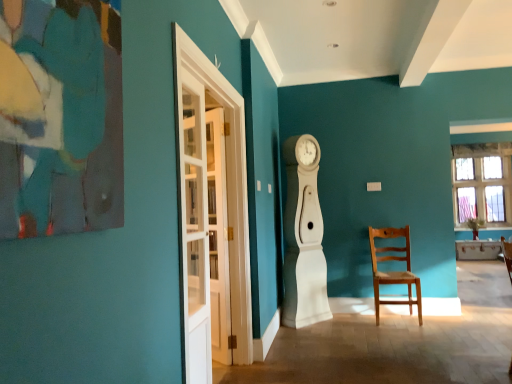
The image size is (512, 384). What do you see at coordinates (211, 212) in the screenshot? I see `white glass door at left, positioned as the 1th glass door in front-to-back order` at bounding box center [211, 212].

Identify the location of white glass door at left, positioned as the 1th glass door in front-to-back order. The width and height of the screenshot is (512, 384). (211, 212).

Locate an element on the screen. This screenshot has height=384, width=512. light brown wooden chair at center right is located at coordinates (393, 271).

Measure the distance between light brown wooden chair at center right and camera.

They are 4.06 meters apart.

Find the location of `white glass door at left, the first glass door in the back-to-front sequence`. white glass door at left, the first glass door in the back-to-front sequence is located at coordinates (194, 229).

Find the location of a particular element. white wooden door at left is located at coordinates (218, 238).

From the image's perspective, between white glass door at left, marked as the 2th glass door in a front-to-back arrangement, and white glass door at left, the 2th glass door from the back, which one is located above?

white glass door at left, marked as the 2th glass door in a front-to-back arrangement, is shown above in the image.

Are white glass door at left, marked as the 2th glass door in a front-to-back arrangement, and white glass door at left, positioned as the 1th glass door in front-to-back order, far apart?

white glass door at left, marked as the 2th glass door in a front-to-back arrangement, is near white glass door at left, positioned as the 1th glass door in front-to-back order, not far away.

Measure the distance from white glass door at left, marked as the 2th glass door in a front-to-back arrangement, to white glass door at left, the 2th glass door from the back.

3.63 inches.

How different are the orientations of white glass door at left, the first glass door in the back-to-front sequence, and white glass door at left, the 2th glass door from the back, in degrees?

0.000584 degrees.

Is clear glass window at upper right located outside light brown wooden chair at center right?

clear glass window at upper right lies outside light brown wooden chair at center right's area.

Who is taller, clear glass window at upper right or light brown wooden chair at center right?

clear glass window at upper right is taller.

Considering the sizes of objects clear glass window at upper right and light brown wooden chair at center right in the image provided, who is smaller, clear glass window at upper right or light brown wooden chair at center right?

Smaller between the two is light brown wooden chair at center right.

From the picture: From a real-world perspective, between white wooden door at left and light brown wooden chair at center right, who is vertically lower?

light brown wooden chair at center right, from a real-world perspective.

From the image's perspective, is white wooden door at left located above or below light brown wooden chair at center right?

white wooden door at left is above light brown wooden chair at center right.

Is white wooden door at left facing towards light brown wooden chair at center right?

No, white wooden door at left is not facing towards light brown wooden chair at center right.

Who is bigger, white wooden door at left or light brown wooden chair at center right?

light brown wooden chair at center right.

Does white wooden door at left appear on the right side of white glass door at left, the first glass door in the back-to-front sequence?

Yes.

From the image's perspective, would you say white wooden door at left is shown under white glass door at left, marked as the 2th glass door in a front-to-back arrangement?

Correct, white wooden door at left appears lower than white glass door at left, marked as the 2th glass door in a front-to-back arrangement, in the image.

In the scene shown: Between white wooden door at left and white glass door at left, the first glass door in the back-to-front sequence, which one has larger width?

With larger width is white glass door at left, the first glass door in the back-to-front sequence.

From the picture: Are light brown wooden chair at center right and clear glass window at upper right making contact?

No, light brown wooden chair at center right is not beside clear glass window at upper right.

The height and width of the screenshot is (384, 512). Identify the location of chair below the clear glass window at upper right (from the image's perspective). (393, 271).

From the image's perspective, which one is positioned lower, light brown wooden chair at center right or clear glass window at upper right?

light brown wooden chair at center right, from the image's perspective.

Image resolution: width=512 pixels, height=384 pixels. In order to click on chair beneath the white glass door at left, marked as the 2th glass door in a front-to-back arrangement (from a real-world perspective) in this screenshot , I will do `click(393, 271)`.

From a real-world perspective, between light brown wooden chair at center right and white glass door at left, the first glass door in the back-to-front sequence, who is vertically lower?

light brown wooden chair at center right, from a real-world perspective.

Between light brown wooden chair at center right and white glass door at left, marked as the 2th glass door in a front-to-back arrangement, which one has smaller size?

white glass door at left, marked as the 2th glass door in a front-to-back arrangement, is smaller.

Would you say light brown wooden chair at center right contains white glass door at left, marked as the 2th glass door in a front-to-back arrangement?

No, white glass door at left, marked as the 2th glass door in a front-to-back arrangement, is not a part of light brown wooden chair at center right.

From the image's perspective, which is above, light brown wooden chair at center right or white glass door at left, the 2th glass door from the back?

white glass door at left, the 2th glass door from the back, is shown above in the image.

Based on the photo, is light brown wooden chair at center right positioned far away from white glass door at left, the 2th glass door from the back?

Yes, light brown wooden chair at center right and white glass door at left, the 2th glass door from the back, are quite far apart.

Does point (401, 304) come farther from viewer compared to point (190, 325)?

Yes, point (401, 304) is behind point (190, 325).

Identify the location of chair behind the white glass door at left, the 2th glass door from the back. (393, 271).

You are a GUI agent. You are given a task and a screenshot of the screen. Output one action in this format:
    pyautogui.click(x=<x>, y=<y>)
    Task: Click on the glass door lying in front of the white glass door at left, marked as the 2th glass door in a front-to-back arrangement
    
    Given the screenshot: What is the action you would take?
    pyautogui.click(x=211, y=212)

Locate an element on the screen. This screenshot has width=512, height=384. window lying on the right of light brown wooden chair at center right is located at coordinates (482, 183).

When comparing their distances from white wooden door at left, does light brown wooden chair at center right or white glass door at left, marked as the 2th glass door in a front-to-back arrangement, seem closer?

Among the two, white glass door at left, marked as the 2th glass door in a front-to-back arrangement, is located nearer to white wooden door at left.

Looking at the image, which one is located closer to white glass door at left, marked as the 2th glass door in a front-to-back arrangement, white wooden door at left or light brown wooden chair at center right?

white wooden door at left is closer to white glass door at left, marked as the 2th glass door in a front-to-back arrangement.

Which object lies further to the anchor point white wooden door at left, white glass door at left, marked as the 2th glass door in a front-to-back arrangement, or light brown wooden chair at center right?

The object further to white wooden door at left is light brown wooden chair at center right.

Based on the photo, when comparing their distances from white glass door at left, the first glass door in the back-to-front sequence, does clear glass window at upper right or white wooden door at left seem further?

Based on the image, clear glass window at upper right appears to be further to white glass door at left, the first glass door in the back-to-front sequence.

Looking at the image, which one is located closer to white wooden door at left, white glass door at left, marked as the 2th glass door in a front-to-back arrangement, or clear glass window at upper right?

white glass door at left, marked as the 2th glass door in a front-to-back arrangement, is closer to white wooden door at left.

Looking at this image, which object lies nearer to the anchor point light brown wooden chair at center right, white wooden door at left or white glass door at left, the first glass door in the back-to-front sequence?

Based on the image, white wooden door at left appears to be nearer to light brown wooden chair at center right.

When comparing their distances from clear glass window at upper right, does white glass door at left, the first glass door in the back-to-front sequence, or light brown wooden chair at center right seem closer?

Based on the image, light brown wooden chair at center right appears to be nearer to clear glass window at upper right.

When comparing their distances from light brown wooden chair at center right, does white glass door at left, the 2th glass door from the back, or white glass door at left, marked as the 2th glass door in a front-to-back arrangement, seem further?

The object further to light brown wooden chair at center right is white glass door at left, marked as the 2th glass door in a front-to-back arrangement.

This screenshot has width=512, height=384. I want to click on chair between white glass door at left, marked as the 2th glass door in a front-to-back arrangement, and clear glass window at upper right from front to back, so click(x=393, y=271).

The height and width of the screenshot is (384, 512). I want to click on door between white glass door at left, the first glass door in the back-to-front sequence, and clear glass window at upper right, along the z-axis, so click(x=218, y=238).

What are the coordinates of `door between white glass door at left, the 2th glass door from the back, and clear glass window at upper right from front to back` in the screenshot? It's located at (218, 238).

The width and height of the screenshot is (512, 384). I want to click on glass door between white glass door at left, the 2th glass door from the back, and clear glass window at upper right in the front-back direction, so click(194, 229).